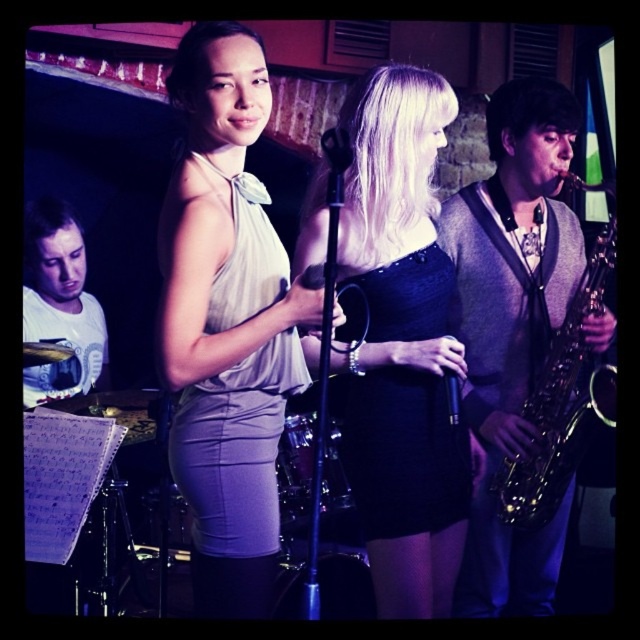
Who is shorter, gold shiny saxophone at right or white matte shirt at upper left?

With less height is white matte shirt at upper left.

Is gold shiny saxophone at right above white matte shirt at upper left?

No.

Is point (560, 461) positioned before point (29, 298)?

Yes.

Where is `gold shiny saxophone at right`? gold shiny saxophone at right is located at coordinates (561, 403).

Which is below, black matte microphone at center or black metallic microphone at center?

black metallic microphone at center

Does black matte microphone at center have a lesser height compared to black metallic microphone at center?

Yes, black matte microphone at center is shorter than black metallic microphone at center.

Who is more forward, (339, 134) or (444, 376)?

Point (339, 134) is in front.

Where is `black matte microphone at center`? This screenshot has height=640, width=640. black matte microphone at center is located at coordinates (337, 148).

Does black sequined dress at center appear on the right side of gold shiny saxophone at right?

Incorrect, black sequined dress at center is not on the right side of gold shiny saxophone at right.

Between black sequined dress at center and gold shiny saxophone at right, which one has less height?

Standing shorter between the two is gold shiny saxophone at right.

Where is `black sequined dress at center`? The width and height of the screenshot is (640, 640). black sequined dress at center is located at coordinates (401, 342).